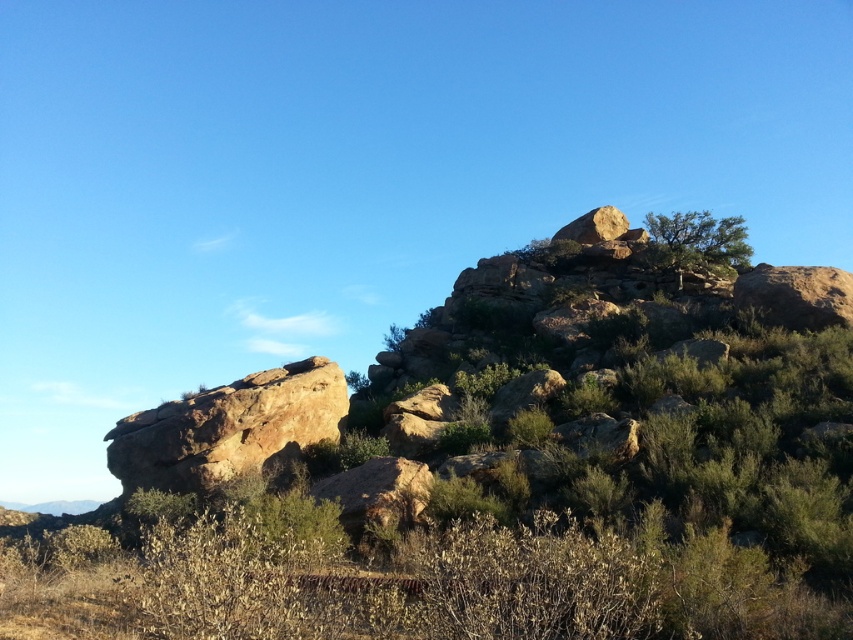
You are navigating a rocky terrain and need to locate the green shrubbery at upper center. According to the coordinates provided, where exactly is it positioned?

The green shrubbery at upper center is located at point coordinates of 0.738 on the x axis and 0.580 on the y axis.

You are a hiker trying to navigate through the rocky terrain. You notice two shrubs ahead of you. Which shrub would require more space to walk around, the green shrubbery at upper center or the green leafy shrub at upper right?

The green shrubbery at upper center requires more space to walk around because its width surpasses that of the green leafy shrub at upper right.

In the scene shown: You are a hiker trying to navigate between the green shrubbery at upper center and the green leafy shrub at upper right. Which shrub is positioned lower in the image?

The green shrubbery at upper center is located below the green leafy shrub at upper right, so it is positioned lower in the image.